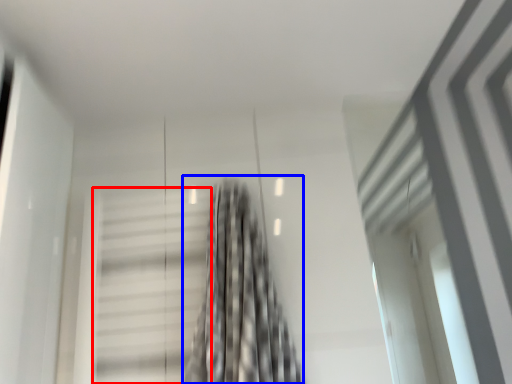
Question: Which of the following is the farthest to the observer, stairs (highlighted by a red box) or curtain (highlighted by a blue box)?

Choices:
 (A) stairs
 (B) curtain

Answer: (A)